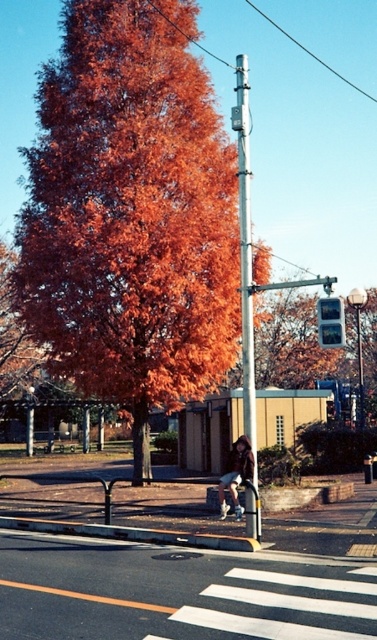
Question: Estimate the real-world distances between objects in this image. Which object is farther from the denim jacket at center?

Choices:
 (A) metallic gray traffic light at center-right
 (B) silver metallic pole at center

Answer: (B)

Question: Can you confirm if white painted lines at crosswalk center is positioned to the left of denim jacket at center?

Choices:
 (A) no
 (B) yes

Answer: (B)

Question: Which object appears farthest from the camera in this image?

Choices:
 (A) white painted lines at crosswalk center
 (B) silver metallic pole at center
 (C) orange leafy tree at center

Answer: (C)

Question: Does white painted lines at crosswalk center appear on the right side of metallic gray traffic light at center-right?

Choices:
 (A) yes
 (B) no

Answer: (B)

Question: Is silver metallic pole at center wider than denim jacket at center?

Choices:
 (A) no
 (B) yes

Answer: (B)

Question: Which of these objects is positioned farthest from the denim jacket at center?

Choices:
 (A) metallic gray traffic light at center-right
 (B) white painted lines at crosswalk center
 (C) silver metallic pole at center
 (D) orange leafy tree at center

Answer: (D)